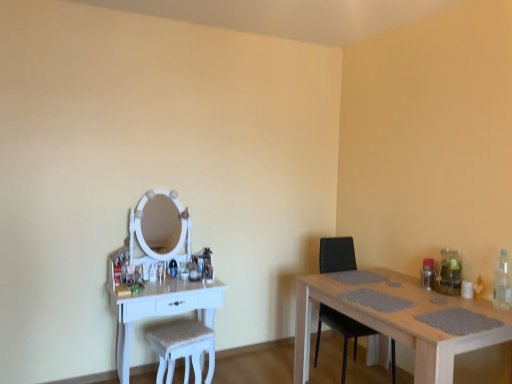
Question: Is light brown wooden table at right, which is the second table in left-to-right order, thinner than clear plastic bottle at right?

Choices:
 (A) yes
 (B) no

Answer: (B)

Question: Is clear plastic bottle at right completely or partially inside light brown wooden table at right, which is the second table in left-to-right order?

Choices:
 (A) yes
 (B) no

Answer: (B)

Question: Is the depth of light brown wooden table at right, which is the second table in left-to-right order, less than that of clear plastic bottle at right?

Choices:
 (A) yes
 (B) no

Answer: (A)

Question: Can you confirm if light brown wooden table at right, which is the second table in left-to-right order, is bigger than clear plastic bottle at right?

Choices:
 (A) no
 (B) yes

Answer: (B)

Question: Is light brown wooden table at right, the 1th table from the right, turned away from clear plastic bottle at right?

Choices:
 (A) no
 (B) yes

Answer: (A)

Question: From the image's perspective, is clear plastic bottle at right above or below white fabric swivel chair at center?

Choices:
 (A) below
 (B) above

Answer: (B)

Question: Is point coord(505,268) positioned closer to the camera than point coord(150,334)?

Choices:
 (A) farther
 (B) closer

Answer: (B)

Question: From a real-world perspective, relative to white fabric swivel chair at center, is clear plastic bottle at right vertically above or below?

Choices:
 (A) below
 (B) above

Answer: (B)

Question: Based on their sizes in the image, would you say clear plastic bottle at right is bigger or smaller than white fabric swivel chair at center?

Choices:
 (A) big
 (B) small

Answer: (B)

Question: Is black leather chair at right to the left or to the right of white wood table at left, which is the second table in right-to-left order, in the image?

Choices:
 (A) right
 (B) left

Answer: (A)

Question: From a real-world perspective, is black leather chair at right above or below white wood table at left, which is the 1th table in left-to-right order?

Choices:
 (A) below
 (B) above

Answer: (B)

Question: In terms of width, does black leather chair at right look wider or thinner when compared to white wood table at left, which is the 1th table in left-to-right order?

Choices:
 (A) thin
 (B) wide

Answer: (B)

Question: Is black leather chair at right in front of or behind white wood table at left, which is the 1th table in left-to-right order, in the image?

Choices:
 (A) behind
 (B) front

Answer: (A)

Question: In terms of height, does white fabric swivel chair at center look taller or shorter compared to black leather chair at right?

Choices:
 (A) tall
 (B) short

Answer: (B)

Question: From the image's perspective, is white fabric swivel chair at center positioned above or below black leather chair at right?

Choices:
 (A) above
 (B) below

Answer: (B)